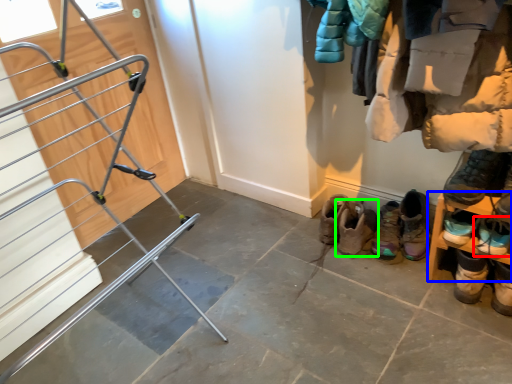
Question: Considering the real-world distances, which object is closest to footwear (highlighted by a red box)? shelf (highlighted by a blue box) or footwear (highlighted by a green box).

Choices:
 (A) shelf
 (B) footwear

Answer: (A)